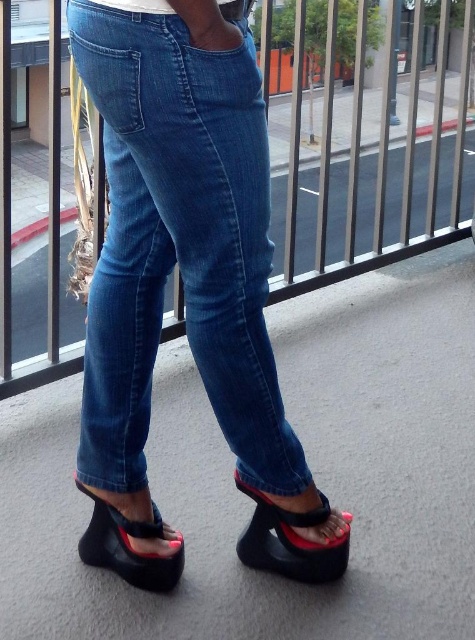
Question: Does denim at center come in front of black rubber sandal at lower center?

Choices:
 (A) yes
 (B) no

Answer: (A)

Question: Estimate the real-world distances between objects in this image. Which object is farther from the black rubber wedge sandal at lower left?

Choices:
 (A) metallic silver rail at upper center
 (B) black rubber sandal at lower center

Answer: (A)

Question: Observing the image, what is the correct spatial positioning of denim at center in reference to black rubber wedge sandal at lower left?

Choices:
 (A) above
 (B) below

Answer: (A)

Question: Which is nearer to the black rubber wedge sandal at lower left?

Choices:
 (A) denim at center
 (B) metallic silver rail at upper center
 (C) black rubber sandal at lower center

Answer: (C)

Question: Which point is closer to the camera taking this photo?

Choices:
 (A) (257, 550)
 (B) (160, 536)
 (C) (121, 307)

Answer: (C)

Question: Can you confirm if denim at center is thinner than black rubber sandal at lower center?

Choices:
 (A) yes
 (B) no

Answer: (B)